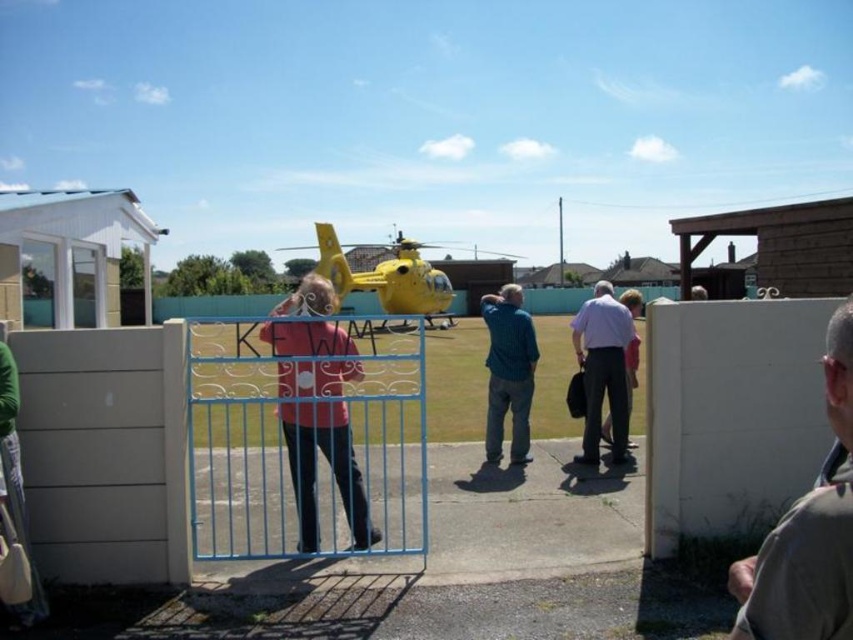
Question: Can you confirm if matte red sweater at center is bigger than light purple cotton shirt at center?

Choices:
 (A) yes
 (B) no

Answer: (B)

Question: Is matte red sweater at center positioned before light purple shirt at center?

Choices:
 (A) yes
 (B) no

Answer: (A)

Question: Which is farther from the blue textured shirt at center?

Choices:
 (A) gray fabric shirt at right
 (B) matte red sweater at center
 (C) blue metal gate at center

Answer: (A)

Question: Can you confirm if matte red sweater at center is smaller than blue textured shirt at center?

Choices:
 (A) no
 (B) yes

Answer: (B)

Question: Which point is farther to the camera?

Choices:
 (A) light purple cotton shirt at center
 (B) blue textured shirt at center
 (C) yellow matte helicopter at center

Answer: (A)

Question: Which of the following is the farthest from the observer?

Choices:
 (A) matte red sweater at center
 (B) gray fabric shirt at right
 (C) yellow matte helicopter at center

Answer: (C)